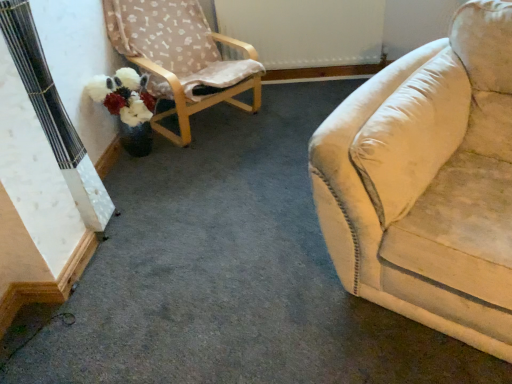
This screenshot has height=384, width=512. What are the coordinates of `fluffy white flower at lower left` in the screenshot? It's located at (123, 95).

What do you see at coordinates (123, 95) in the screenshot? The width and height of the screenshot is (512, 384). I see `fluffy white flower at lower left` at bounding box center [123, 95].

Describe the element at coordinates (181, 58) in the screenshot. I see `wooden chair with fabric cover at upper left` at that location.

This screenshot has width=512, height=384. In order to click on wooden chair with fabric cover at upper left in this screenshot , I will do `click(181, 58)`.

Find the location of a particular element. This screenshot has height=384, width=512. fluffy white flower at lower left is located at coordinates (123, 95).

Looking at this image, is wooden chair with fabric cover at upper left at the right side of fluffy white flower at lower left?

Indeed, wooden chair with fabric cover at upper left is positioned on the right side of fluffy white flower at lower left.

Is wooden chair with fabric cover at upper left closer to the viewer compared to fluffy white flower at lower left?

Yes, wooden chair with fabric cover at upper left is closer to the camera.

Is point (166, 87) less distant than point (139, 117)?

No, (166, 87) is further to viewer.

From the image's perspective, is wooden chair with fabric cover at upper left located above or below fluffy white flower at lower left?

From the image's perspective, wooden chair with fabric cover at upper left appears above fluffy white flower at lower left.

From a real-world perspective, which object stands above the other?

wooden chair with fabric cover at upper left is physically above.

Can you confirm if wooden chair with fabric cover at upper left is thinner than fluffy white flower at lower left?

Incorrect, the width of wooden chair with fabric cover at upper left is not less than that of fluffy white flower at lower left.

Is wooden chair with fabric cover at upper left taller or shorter than fluffy white flower at lower left?

Clearly, wooden chair with fabric cover at upper left is taller compared to fluffy white flower at lower left.

From the picture: Considering the sizes of wooden chair with fabric cover at upper left and fluffy white flower at lower left in the image, is wooden chair with fabric cover at upper left bigger or smaller than fluffy white flower at lower left?

wooden chair with fabric cover at upper left is bigger than fluffy white flower at lower left.

Would you say wooden chair with fabric cover at upper left is outside fluffy white flower at lower left?

Indeed, wooden chair with fabric cover at upper left is completely outside fluffy white flower at lower left.

Are wooden chair with fabric cover at upper left and fluffy white flower at lower left located far from each other?

No, there isn't a large distance between wooden chair with fabric cover at upper left and fluffy white flower at lower left.

Is fluffy white flower at lower left at the back of wooden chair with fabric cover at upper left?

That's not correct — wooden chair with fabric cover at upper left is not looking away from fluffy white flower at lower left.

You are a GUI agent. You are given a task and a screenshot of the screen. Output one action in this format:
    pyautogui.click(x=<x>, y=<y>)
    Task: Click on the chair on the right of fluffy white flower at lower left
    The height and width of the screenshot is (384, 512).
    Given the screenshot: What is the action you would take?
    pyautogui.click(x=181, y=58)

Is fluffy white flower at lower left to the left of wooden chair with fabric cover at upper left from the viewer's perspective?

Yes, fluffy white flower at lower left is to the left of wooden chair with fabric cover at upper left.

Considering the positions of objects fluffy white flower at lower left and wooden chair with fabric cover at upper left in the image provided, who is behind, fluffy white flower at lower left or wooden chair with fabric cover at upper left?

fluffy white flower at lower left is further away from the camera.

Is point (134, 119) closer or farther from the camera than point (240, 67)?

Clearly, point (134, 119) is closer to the camera than point (240, 67).

From the image's perspective, would you say fluffy white flower at lower left is shown under wooden chair with fabric cover at upper left?

Yes.

From a real-world perspective, relative to wooden chair with fabric cover at upper left, is fluffy white flower at lower left vertically above or below?

fluffy white flower at lower left is below wooden chair with fabric cover at upper left.

Can you confirm if fluffy white flower at lower left is thinner than wooden chair with fabric cover at upper left?

Yes, fluffy white flower at lower left is thinner than wooden chair with fabric cover at upper left.

Is fluffy white flower at lower left taller than wooden chair with fabric cover at upper left?

In fact, fluffy white flower at lower left may be shorter than wooden chair with fabric cover at upper left.

Based on their sizes in the image, would you say fluffy white flower at lower left is bigger or smaller than wooden chair with fabric cover at upper left?

Considering their sizes, fluffy white flower at lower left takes up less space than wooden chair with fabric cover at upper left.

Is fluffy white flower at lower left outside of wooden chair with fabric cover at upper left?

Indeed, fluffy white flower at lower left is completely outside wooden chair with fabric cover at upper left.

Is fluffy white flower at lower left directly adjacent to wooden chair with fabric cover at upper left?

They are not placed beside each other.

Is fluffy white flower at lower left aimed at wooden chair with fabric cover at upper left?

Yes.

Consider the image. Measure the distance from fluffy white flower at lower left to wooden chair with fabric cover at upper left.

A distance of 13.38 inches exists between fluffy white flower at lower left and wooden chair with fabric cover at upper left.

In order to click on flower lying on the left of wooden chair with fabric cover at upper left in this screenshot , I will do 123,95.

Locate an element on the screen. The height and width of the screenshot is (384, 512). flower that is on the left side of wooden chair with fabric cover at upper left is located at coordinates (123, 95).

The image size is (512, 384). There is a fluffy white flower at lower left. In order to click on chair above it (from a real-world perspective) in this screenshot , I will do `click(181, 58)`.